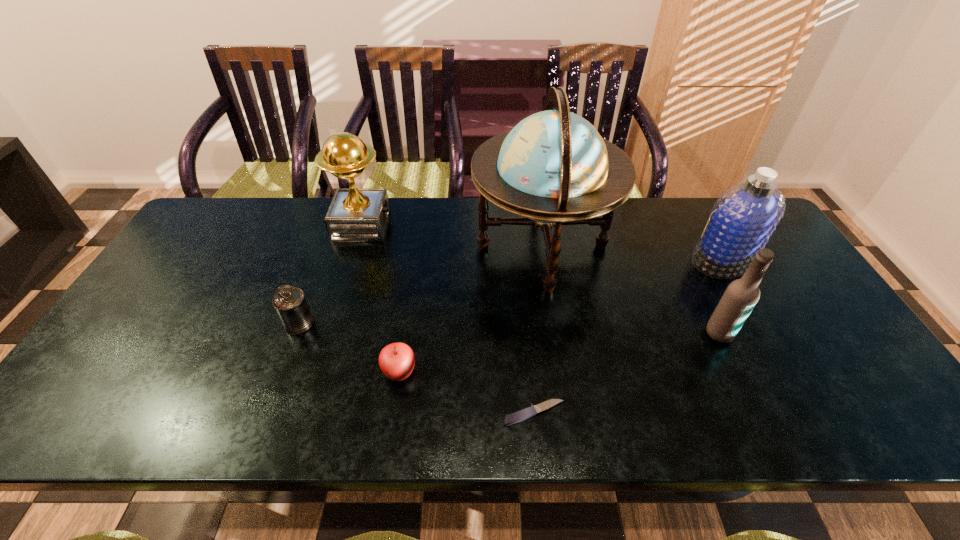
Find the location of `object that is the fourth closest to the cleansing agent`. object that is the fourth closest to the cleansing agent is located at coordinates (396, 360).

This screenshot has width=960, height=540. What are the coordinates of `vacant area that satisfies the following two spatial constraints: 1. on the surface of the tallest object; 2. on the back side of the cleansing agent` in the screenshot? It's located at (544, 261).

Where is `free spot that satisfies the following two spatial constraints: 1. on the front-facing side of the apple; 2. on the left side of the award`? This screenshot has height=540, width=960. free spot that satisfies the following two spatial constraints: 1. on the front-facing side of the apple; 2. on the left side of the award is located at coordinates (317, 372).

The width and height of the screenshot is (960, 540). Find the location of `vacant space that satisfies the following two spatial constraints: 1. on the back side of the steak knife; 2. on the front-facing side of the award`. vacant space that satisfies the following two spatial constraints: 1. on the back side of the steak knife; 2. on the front-facing side of the award is located at coordinates (x=516, y=225).

Image resolution: width=960 pixels, height=540 pixels. I want to click on free space that satisfies the following two spatial constraints: 1. on the back side of the nearest object; 2. on the right side of the cleansing agent, so click(520, 261).

Locate an element on the screen. The image size is (960, 540). vacant space that satisfies the following two spatial constraints: 1. on the front-facing side of the award; 2. on the left side of the cleansing agent is located at coordinates (351, 261).

Locate an element on the screen. free space that satisfies the following two spatial constraints: 1. on the front-facing side of the third object from left to right; 2. on the left side of the award is located at coordinates (317, 372).

Find the location of a particular element. The height and width of the screenshot is (540, 960). vacant area that satisfies the following two spatial constraints: 1. on the front-facing side of the award; 2. on the back side of the shortest object is located at coordinates (304, 413).